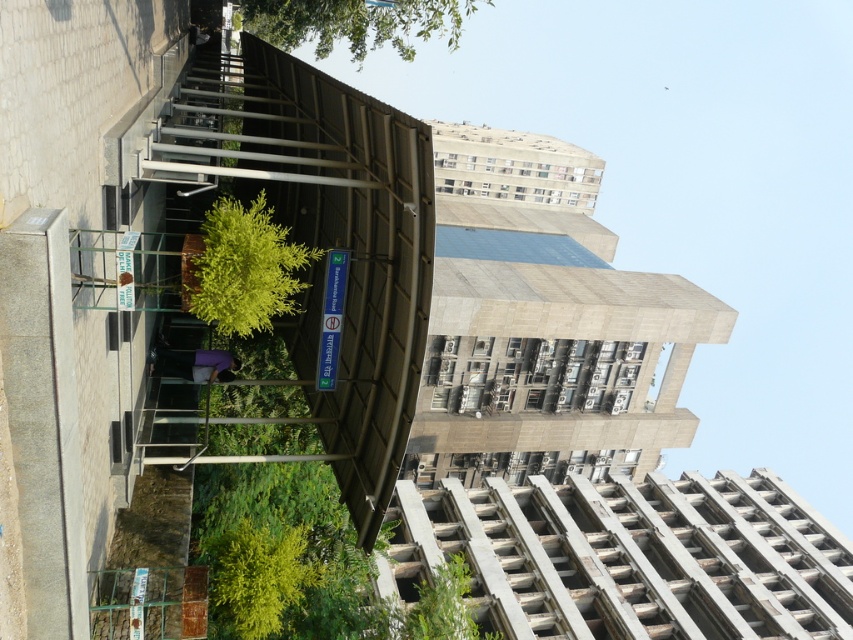
You are a GUI agent. You are given a task and a screenshot of the screen. Output one action in this format:
    pyautogui.click(x=<x>, y=<y>)
    Task: Click on the green leafy tree at center
    
    Given the screenshot: What is the action you would take?
    pyautogui.click(x=245, y=268)

Can you confirm if green leafy tree at center is bigger than green leafy tree at upper center?

Incorrect, green leafy tree at center is not larger than green leafy tree at upper center.

Locate an element on the screen. The height and width of the screenshot is (640, 853). green leafy tree at center is located at coordinates click(x=245, y=268).